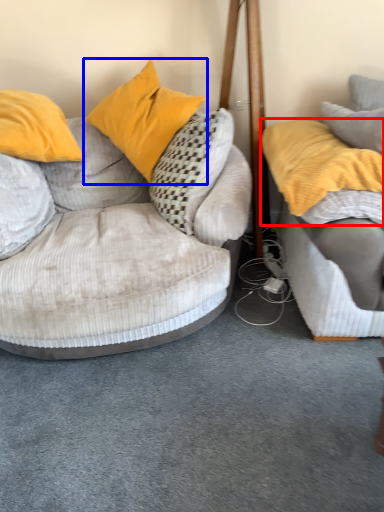
Question: Which object is further to the camera taking this photo, pillow (highlighted by a red box) or pillow (highlighted by a blue box)?

Choices:
 (A) pillow
 (B) pillow

Answer: (B)